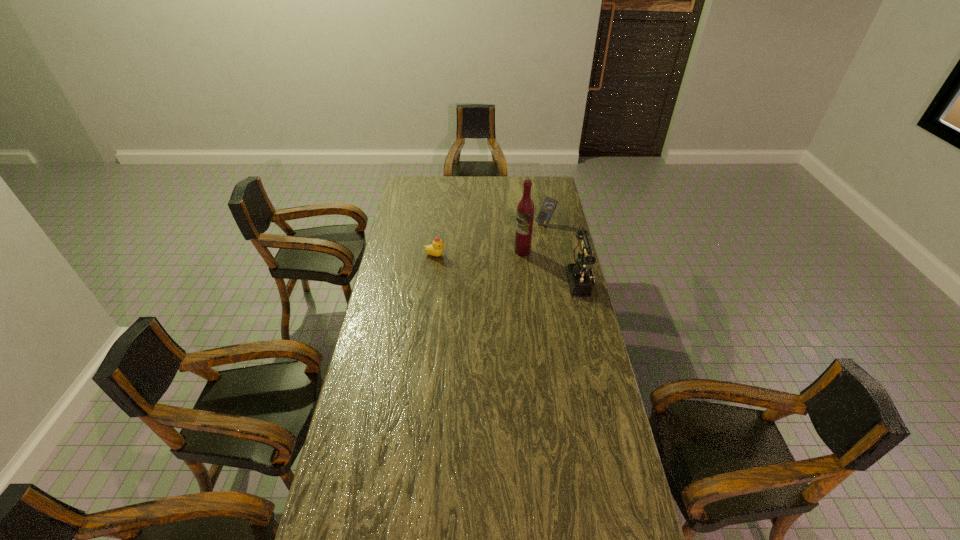
In order to click on duckling in this screenshot , I will do `click(436, 248)`.

The image size is (960, 540). Identify the location of the shortest object. (436, 248).

Locate an element on the screen. the second tallest object is located at coordinates (580, 278).

You are a GUI agent. You are given a task and a screenshot of the screen. Output one action in this format:
    pyautogui.click(x=<x>, y=<y>)
    Task: Click on the nearest object
    
    Given the screenshot: What is the action you would take?
    pyautogui.click(x=580, y=278)

Image resolution: width=960 pixels, height=540 pixels. Find the location of `calculator`. calculator is located at coordinates (548, 206).

Locate an element on the screen. This screenshot has height=540, width=960. the third tallest object is located at coordinates (548, 206).

Image resolution: width=960 pixels, height=540 pixels. In order to click on the tallest object in this screenshot , I will do `click(525, 210)`.

The height and width of the screenshot is (540, 960). Find the location of `the third object from right to left`. the third object from right to left is located at coordinates (525, 210).

Find the location of a particular element. The image size is (960, 540). free region located 0.070m on the front-facing side of the duckling is located at coordinates (461, 255).

Image resolution: width=960 pixels, height=540 pixels. In order to click on free location located 0.220m on the front-facing side of the farthest object in this screenshot , I will do pos(517,247).